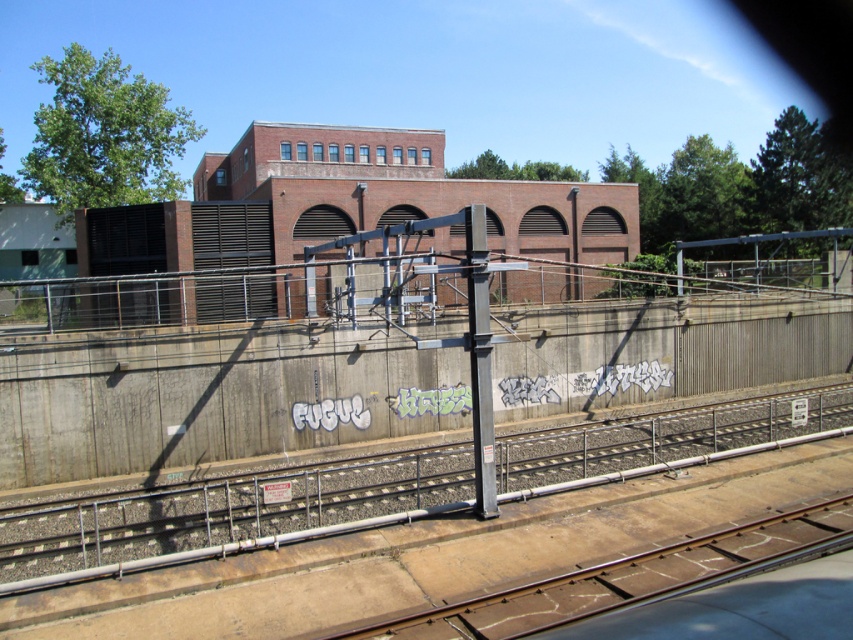
Does concrete train track at center have a smaller size compared to brown metal train track at lower center?

No, concrete train track at center is not smaller than brown metal train track at lower center.

This screenshot has width=853, height=640. What do you see at coordinates (221, 515) in the screenshot?
I see `concrete train track at center` at bounding box center [221, 515].

Does point (677, 444) come behind point (444, 627)?

Yes, it is.

The width and height of the screenshot is (853, 640). Find the location of `concrete train track at center`. concrete train track at center is located at coordinates (221, 515).